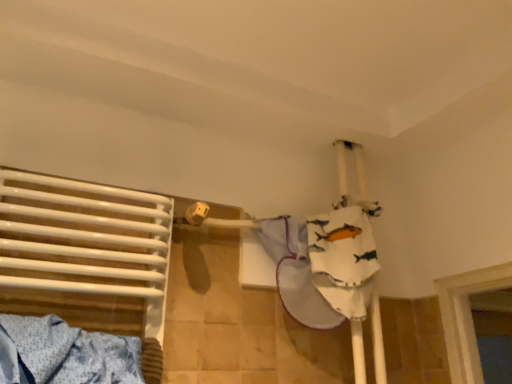
Describe the element at coordinates (86, 256) in the screenshot. I see `white glossy towel at left` at that location.

Image resolution: width=512 pixels, height=384 pixels. In order to click on white glossy towel at left in this screenshot , I will do `click(86, 256)`.

Identify the location of white cotton cloth at upper right. The width and height of the screenshot is (512, 384). (323, 262).

What do you see at coordinates (323, 262) in the screenshot?
I see `white cotton cloth at upper right` at bounding box center [323, 262].

Identify the location of white glossy towel at left. This screenshot has width=512, height=384. (86, 256).

Between white cotton cloth at upper right and white glossy towel at left, which one appears on the right side from the viewer's perspective?

From the viewer's perspective, white cotton cloth at upper right appears more on the right side.

Looking at this image, considering the positions of objects white cotton cloth at upper right and white glossy towel at left in the image provided, who is in front, white cotton cloth at upper right or white glossy towel at left?

white glossy towel at left.

Which is in front, point (338, 309) or point (42, 307)?

The point (42, 307) is more forward.

From the image's perspective, is white cotton cloth at upper right located beneath white glossy towel at left?

Yes, from the image's perspective, white cotton cloth at upper right is below white glossy towel at left.

Looking at this image, from a real-world perspective, does white cotton cloth at upper right stand above white glossy towel at left?

Yes.

Which of these two, white cotton cloth at upper right or white glossy towel at left, is thinner?

Thinner between the two is white glossy towel at left.

Is white cotton cloth at upper right shorter than white glossy towel at left?

Yes.

Which of these two, white cotton cloth at upper right or white glossy towel at left, is smaller?

white cotton cloth at upper right is smaller.

Is white glossy towel at left surrounded by white cotton cloth at upper right?

Definitely not — white glossy towel at left is not inside white cotton cloth at upper right.

Is white cotton cloth at upper right next to white glossy towel at left and touching it?

white cotton cloth at upper right and white glossy towel at left are not in contact.

Could you tell me if white cotton cloth at upper right is facing white glossy towel at left?

No, white cotton cloth at upper right is not aimed at white glossy towel at left.

How distant is white cotton cloth at upper right from white glossy towel at left?

They are 17.20 inches apart.

This screenshot has height=384, width=512. In order to click on bed above the white cotton cloth at upper right (from the image's perspective) in this screenshot , I will do `click(86, 256)`.

Which object is positioned more to the left, white glossy towel at left or white cotton cloth at upper right?

From the viewer's perspective, white glossy towel at left appears more on the left side.

Which object is further away from the camera, white glossy towel at left or white cotton cloth at upper right?

white cotton cloth at upper right is more distant.

Which is behind, point (152, 382) or point (298, 253)?

Positioned behind is point (298, 253).

From the image's perspective, does white glossy towel at left appear lower than white cotton cloth at upper right?

Incorrect, from the image's perspective, white glossy towel at left is higher than white cotton cloth at upper right.

From a real-world perspective, which object rests below the other?

white glossy towel at left.

Is white glossy towel at left wider or thinner than white cotton cloth at upper right?

white glossy towel at left is thinner than white cotton cloth at upper right.

Consider the image. Which of these two, white glossy towel at left or white cotton cloth at upper right, stands taller?

Standing taller between the two is white glossy towel at left.

Is white glossy towel at left bigger than white cotton cloth at upper right?

Yes.

Choose the correct answer: Is white glossy towel at left inside white cotton cloth at upper right or outside it?

white glossy towel at left lies outside white cotton cloth at upper right.

Are white glossy towel at left and white cotton cloth at upper right making contact?

There is a gap between white glossy towel at left and white cotton cloth at upper right.

Could you tell me if white glossy towel at left is turned towards white cotton cloth at upper right?

No, white glossy towel at left is not aimed at white cotton cloth at upper right.

What's the angular difference between white glossy towel at left and white cotton cloth at upper right's facing directions?

The angular difference between white glossy towel at left and white cotton cloth at upper right is 0.00164 degrees.

Locate an element on the screen. The image size is (512, 384). clothing on the right of white glossy towel at left is located at coordinates (323, 262).

Locate an element on the screen. The width and height of the screenshot is (512, 384). bed above the white cotton cloth at upper right (from the image's perspective) is located at coordinates (86, 256).

This screenshot has width=512, height=384. I want to click on bed that appears in front of the white cotton cloth at upper right, so 86,256.